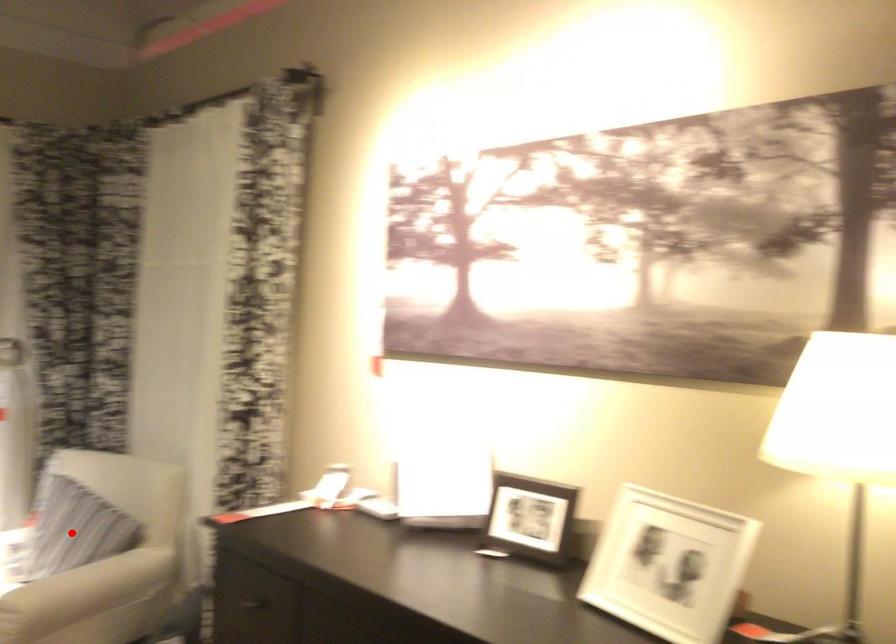
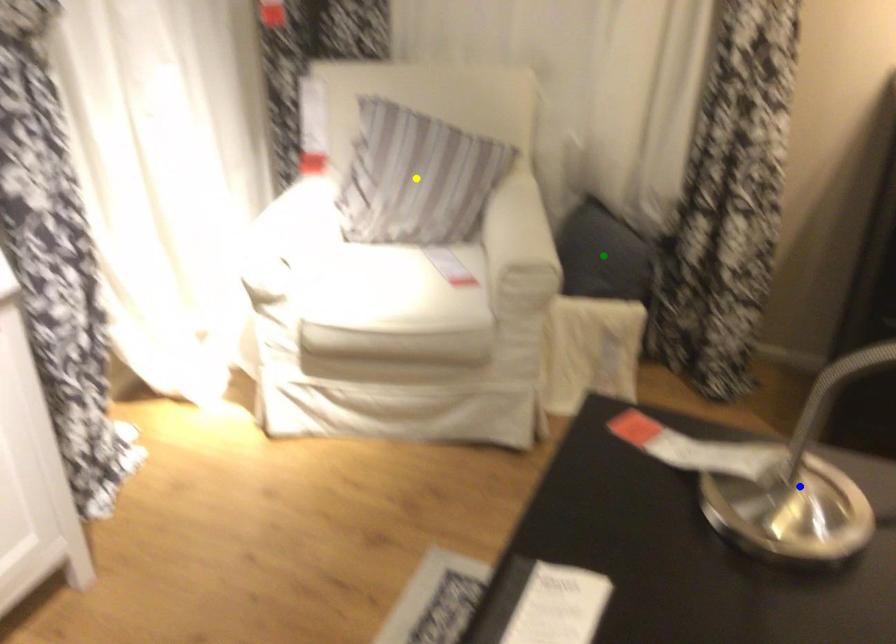
Question: I am providing you with two images of the same scene from different viewpoints. A red point is marked on the first image. You are given multiple points on the second image. Which mark in image 2 goes with the point in image 1?

Choices:
 (A) blue point
 (B) green point
 (C) yellow point

Answer: (C)